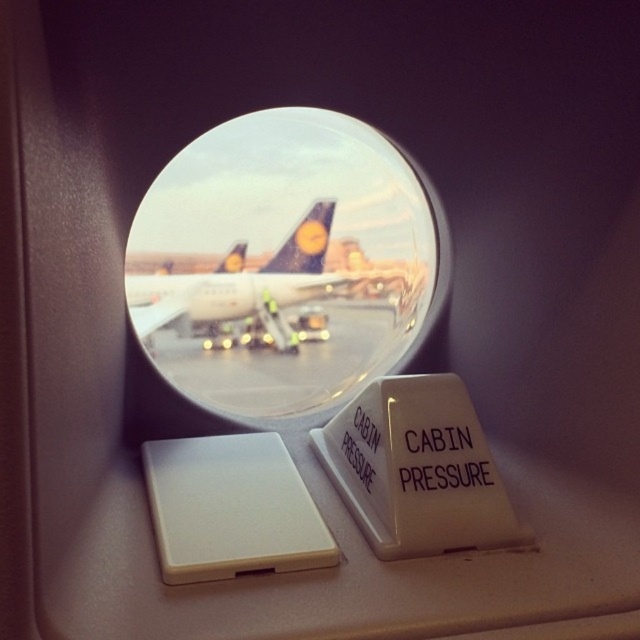
Does point (289, 198) come farther from viewer compared to point (246, 282)?

No, it is not.

Can you confirm if transparent glass airplane window at center is positioned above white glossy airplane at center?

Indeed, transparent glass airplane window at center is positioned over white glossy airplane at center.

Describe the element at coordinates (284, 262) in the screenshot. This screenshot has height=640, width=640. I see `transparent glass airplane window at center` at that location.

Locate an element on the screen. transparent glass airplane window at center is located at coordinates (284, 262).

Who is positioned more to the left, transparent glass airplane window at center or smooth concrete tarmac at center?

From the viewer's perspective, smooth concrete tarmac at center appears more on the left side.

Is transparent glass airplane window at center to the right of smooth concrete tarmac at center from the viewer's perspective?

Correct, you'll find transparent glass airplane window at center to the right of smooth concrete tarmac at center.

I want to click on transparent glass airplane window at center, so click(x=284, y=262).

Can you confirm if smooth concrete tarmac at center is thinner than white glossy airplane at center?

In fact, smooth concrete tarmac at center might be wider than white glossy airplane at center.

Describe the element at coordinates (284, 356) in the screenshot. I see `smooth concrete tarmac at center` at that location.

Locate an element on the screen. The height and width of the screenshot is (640, 640). smooth concrete tarmac at center is located at coordinates (284, 356).